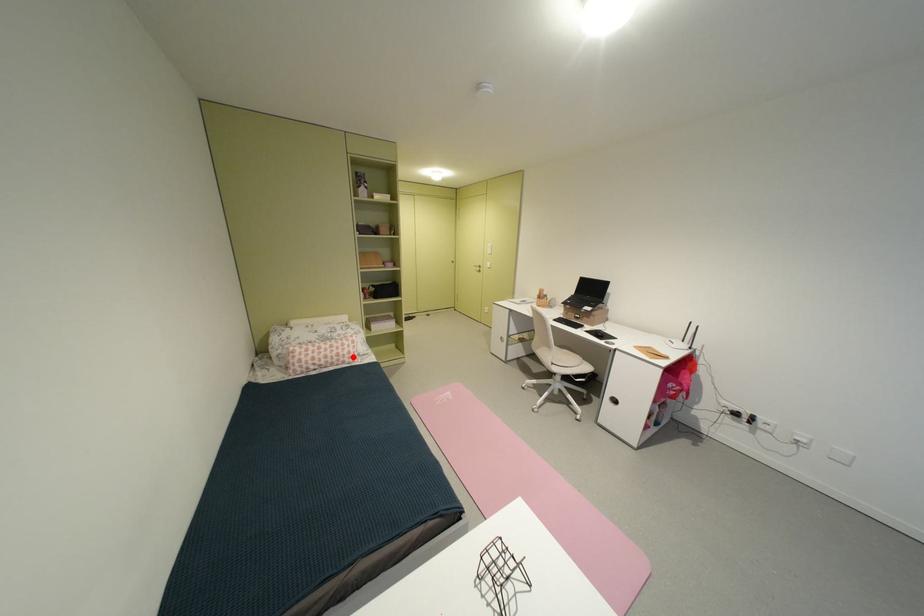
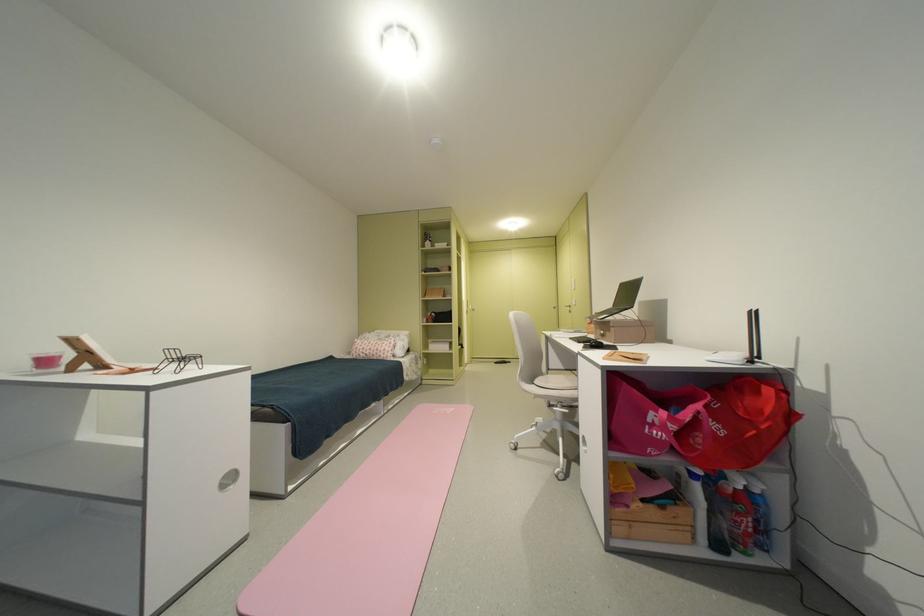
Locate, in the second image, the point that corresponds to the highlighted location in the first image.

(390, 352)